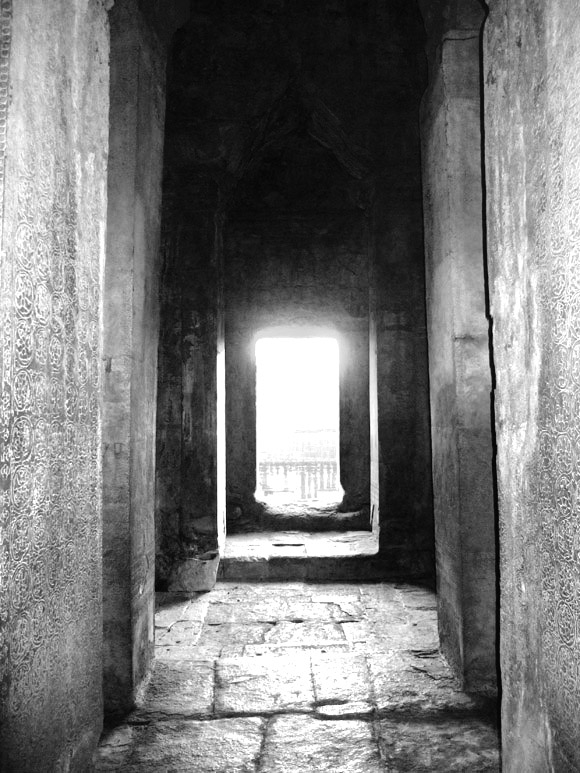
Locate an element on the screen. The width and height of the screenshot is (580, 773). right pillars is located at coordinates (480, 576), (534, 583).